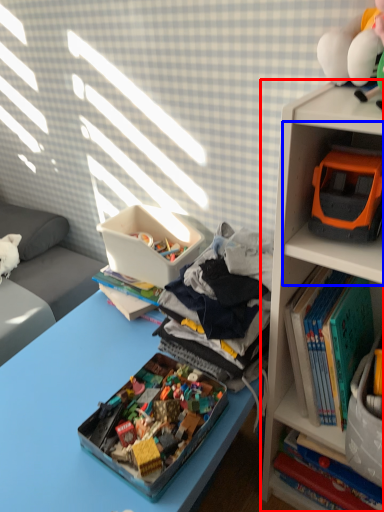
Question: Which object appears closest to the camera in this image, bookcase (highlighted by a red box) or shelf (highlighted by a blue box)?

Choices:
 (A) bookcase
 (B) shelf

Answer: (A)